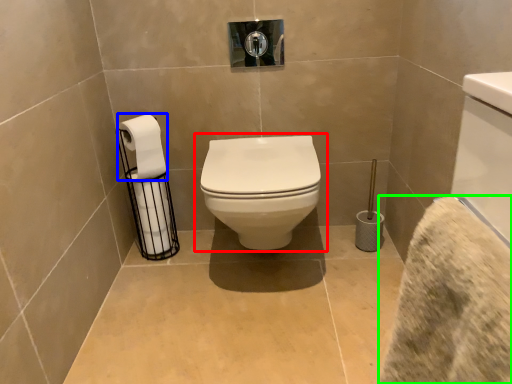
Question: Which is nearer to the toilet (highlighted by a red box)? toilet paper (highlighted by a blue box) or bath towel (highlighted by a green box).

Choices:
 (A) toilet paper
 (B) bath towel

Answer: (A)